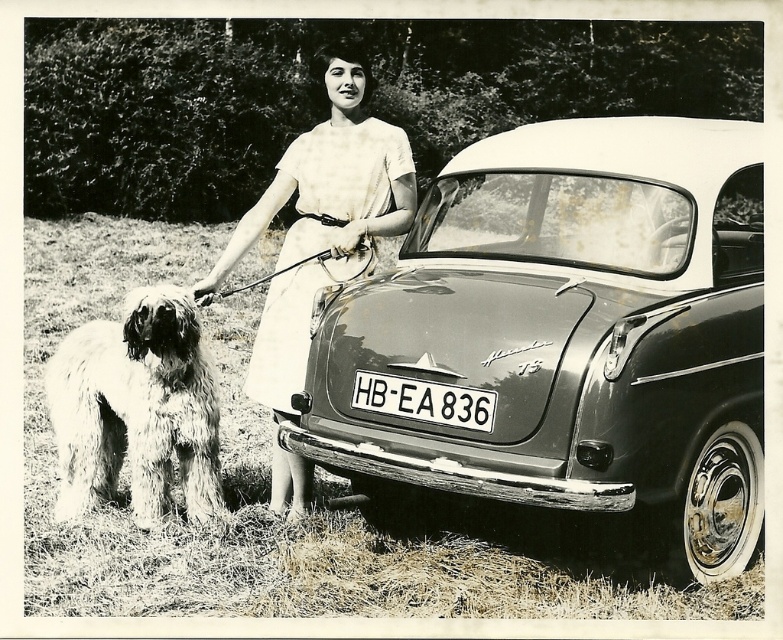
Who is higher up, shiny black car at center or fuzzy fur dog at lower left?

shiny black car at center is higher up.

Is shiny black car at center to the left of fuzzy fur dog at lower left from the viewer's perspective?

In fact, shiny black car at center is to the right of fuzzy fur dog at lower left.

I want to click on shiny black car at center, so click(x=572, y=337).

Who is positioned more to the left, white cotton dress at center or white plastic license plate at center?

Positioned to the left is white cotton dress at center.

The image size is (783, 640). In order to click on white cotton dress at center in this screenshot , I will do `click(320, 220)`.

Which is in front, point (302, 180) or point (392, 385)?

Positioned in front is point (392, 385).

Find the location of a particular element. This screenshot has height=640, width=783. white cotton dress at center is located at coordinates (320, 220).

Which is in front, point (355, 58) or point (80, 461)?

Point (355, 58) is more forward.

Can you confirm if white cotton dress at center is wider than fuzzy fur dog at lower left?

Yes, white cotton dress at center is wider than fuzzy fur dog at lower left.

Image resolution: width=783 pixels, height=640 pixels. Describe the element at coordinates (320, 220) in the screenshot. I see `white cotton dress at center` at that location.

At what (x,y) coordinates should I click in order to perform the action: click on white cotton dress at center. Please return your answer as a coordinate pair (x, y). Looking at the image, I should click on (320, 220).